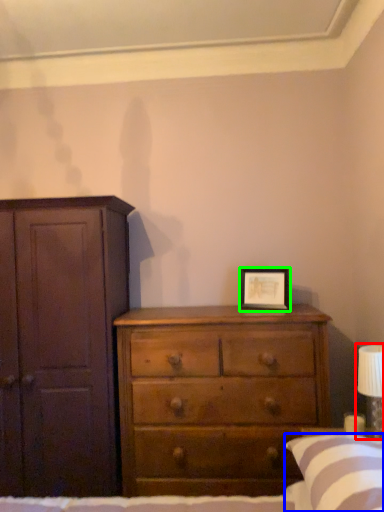
Question: Which is nearer to the bedside lamp (highlighted by a red box)? pillow (highlighted by a blue box) or picture frame (highlighted by a green box).

Choices:
 (A) pillow
 (B) picture frame

Answer: (A)